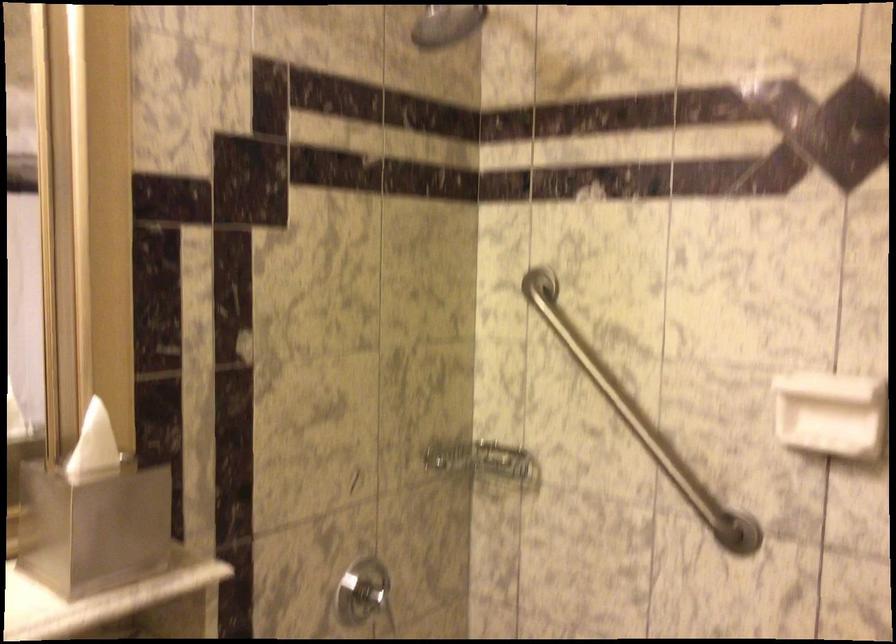
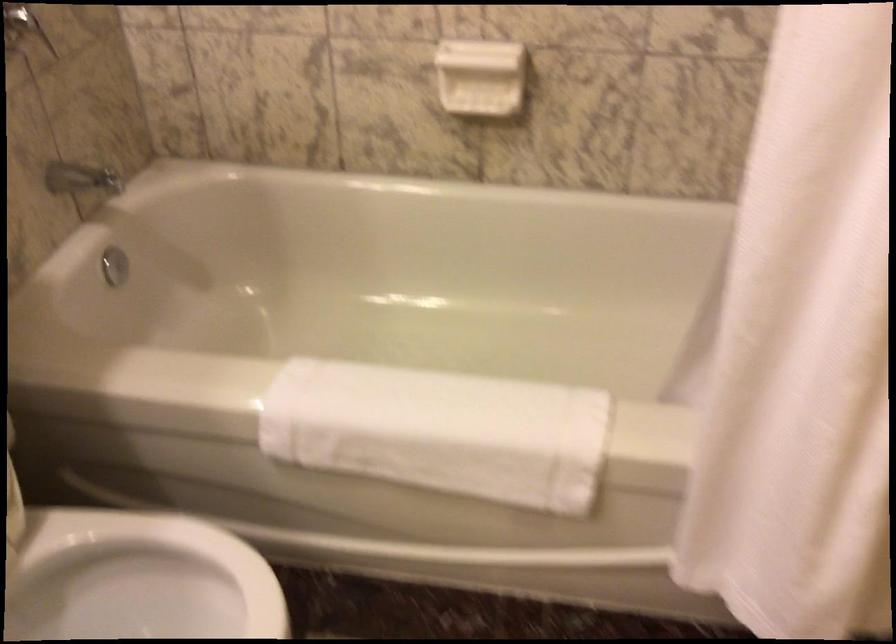
First-person continuous shooting, in which direction is the camera rotating?

The rotation direction of the camera is right-down.